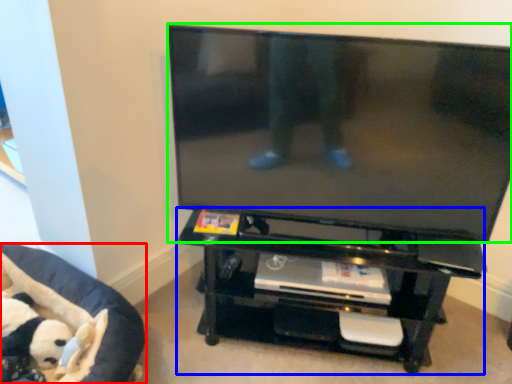
Question: Estimate the real-world distances between objects in this image. Which object is farther from furniture (highlighted by a red box), entertainment center (highlighted by a blue box) or television (highlighted by a green box)?

Choices:
 (A) entertainment center
 (B) television

Answer: (B)